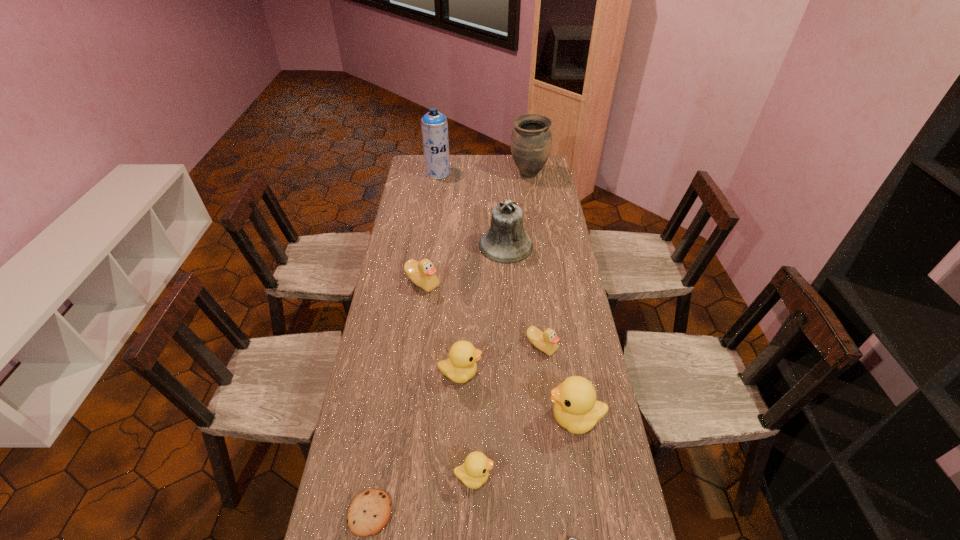
The width and height of the screenshot is (960, 540). In order to click on duck that is at the left edge in this screenshot , I will do `click(422, 273)`.

At what (x,y) coordinates should I click in order to perform the action: click on cookie positioned at the left edge. Please return your answer as a coordinate pair (x, y). Looking at the image, I should click on (369, 513).

In order to click on urn located at the right edge in this screenshot , I will do `click(531, 140)`.

You are a GUI agent. You are given a task and a screenshot of the screen. Output one action in this format:
    pyautogui.click(x=<x>, y=<y>)
    Task: Click on the bell at the right edge
    Image resolution: width=960 pixels, height=540 pixels.
    Given the screenshot: What is the action you would take?
    pyautogui.click(x=506, y=242)

Where is `object located at the far left corner`? This screenshot has height=540, width=960. object located at the far left corner is located at coordinates (434, 125).

The width and height of the screenshot is (960, 540). In order to click on object that is at the far right corner in this screenshot , I will do `click(531, 140)`.

The height and width of the screenshot is (540, 960). I want to click on vacant space at the left edge, so click(x=393, y=244).

Where is `vacant region at the right edge of the desktop`? This screenshot has height=540, width=960. vacant region at the right edge of the desktop is located at coordinates [550, 224].

Where is `empty space that is in between the smallest yellow duck and the seventh nearest object`? This screenshot has width=960, height=540. empty space that is in between the smallest yellow duck and the seventh nearest object is located at coordinates (448, 380).

Identify the location of vacant area that lies between the sixth farthest object and the right beige duck. This screenshot has width=960, height=540. point(501,360).